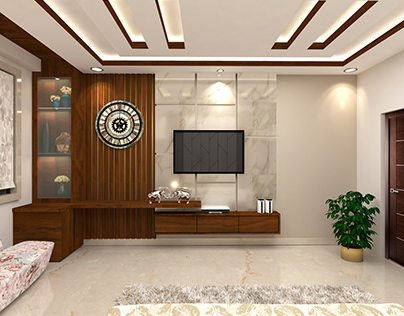
The height and width of the screenshot is (316, 404). What are the coordinates of `blue vase` in the screenshot? It's located at (68, 100), (55, 102).